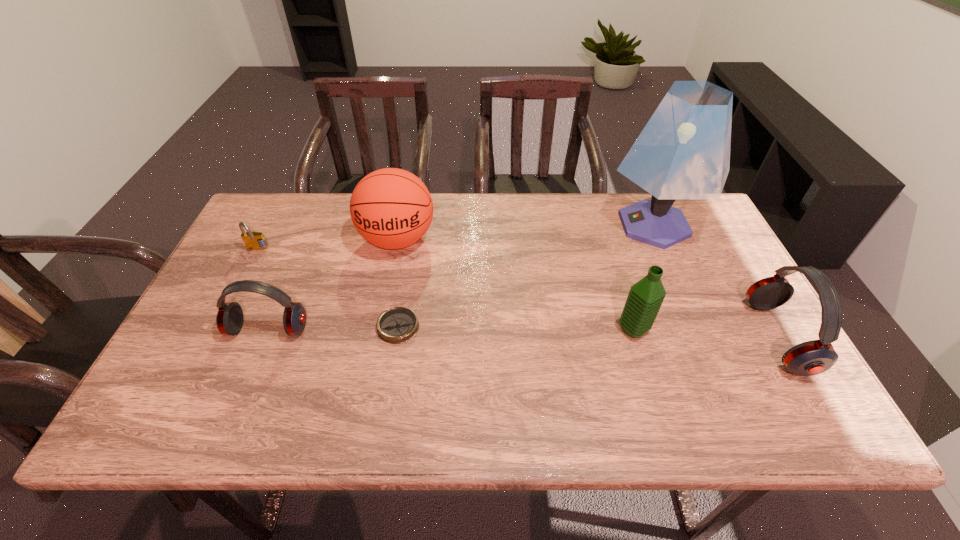
Identify the location of location for an additional earphone to make spacing equal. The width and height of the screenshot is (960, 540). (521, 334).